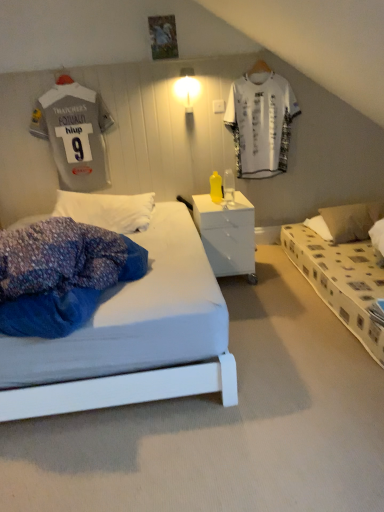
Question: Is yellow plastic bottle at center closer to camera compared to white printed t-shirt at upper center, the 2th t shirt positioned from the left?

Choices:
 (A) no
 (B) yes

Answer: (B)

Question: From the image's perspective, is yellow plastic bottle at center located beneath white printed t-shirt at upper center, the 2th t shirt positioned from the left?

Choices:
 (A) yes
 (B) no

Answer: (A)

Question: From a real-world perspective, is yellow plastic bottle at center over white printed t-shirt at upper center, the 2th t shirt positioned from the left?

Choices:
 (A) no
 (B) yes

Answer: (A)

Question: Is yellow plastic bottle at center oriented towards white printed t-shirt at upper center, which is counted as the 1th t shirt, starting from the right?

Choices:
 (A) no
 (B) yes

Answer: (A)

Question: Is yellow plastic bottle at center surrounding white printed t-shirt at upper center, which is counted as the 1th t shirt, starting from the right?

Choices:
 (A) yes
 (B) no

Answer: (B)

Question: Is yellow plastic bottle at center taller than white printed t-shirt at upper center, which is counted as the 1th t shirt, starting from the right?

Choices:
 (A) yes
 (B) no

Answer: (B)

Question: Is brown fabric pillow at right positioned in front of yellow plastic bottle at center?

Choices:
 (A) no
 (B) yes

Answer: (A)

Question: Is brown fabric pillow at right thinner than yellow plastic bottle at center?

Choices:
 (A) yes
 (B) no

Answer: (B)

Question: From the image's perspective, does brown fabric pillow at right appear lower than yellow plastic bottle at center?

Choices:
 (A) no
 (B) yes

Answer: (B)

Question: Is brown fabric pillow at right oriented away from yellow plastic bottle at center?

Choices:
 (A) yes
 (B) no

Answer: (B)

Question: From a real-world perspective, is brown fabric pillow at right on top of yellow plastic bottle at center?

Choices:
 (A) no
 (B) yes

Answer: (A)

Question: Can you confirm if brown fabric pillow at right is shorter than yellow plastic bottle at center?

Choices:
 (A) yes
 (B) no

Answer: (A)

Question: From a real-world perspective, is brown fabric pillow at right located beneath white glossy light fixture at upper center?

Choices:
 (A) yes
 (B) no

Answer: (A)